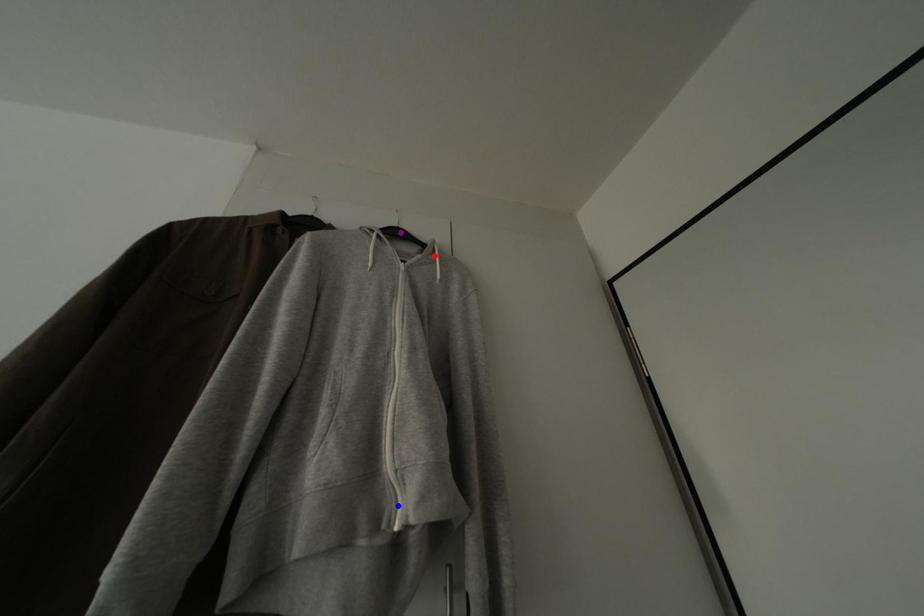
Order these from farthest to nearest:
A) red point
B) purple point
C) blue point

purple point, red point, blue point